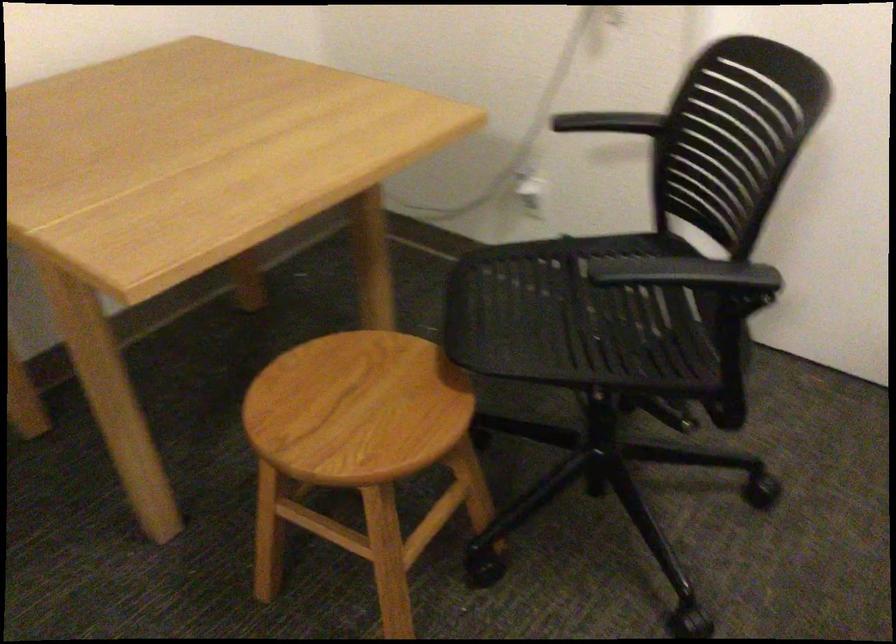
Find where to sit the black chair sitting surface. Please return your answer as a coordinate pair (x, y).

(576, 328)